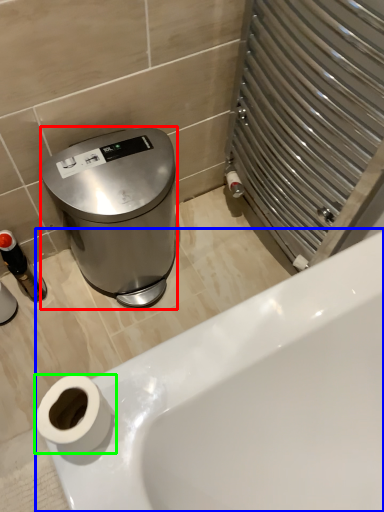
Question: Which object is positioned farthest from appliance (highlighted by a red box)? Select from bathtub (highlighted by a blue box) and toilet paper (highlighted by a green box).

Choices:
 (A) bathtub
 (B) toilet paper

Answer: (B)